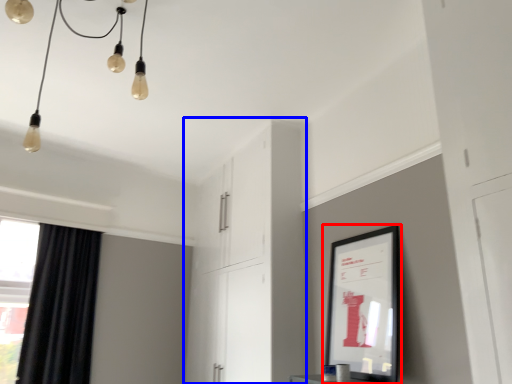
Question: Among these objects, which one is farthest to the camera, picture frame (highlighted by a red box) or dresser (highlighted by a blue box)?

Choices:
 (A) picture frame
 (B) dresser

Answer: (B)